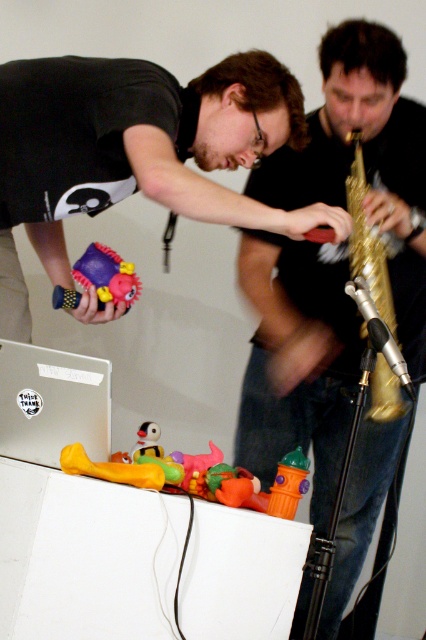
Can you confirm if silver metallic laptop at center is taller than rubberized plastic toy at center?

Yes, silver metallic laptop at center is taller than rubberized plastic toy at center.

Is silver metallic laptop at center positioned before rubberized plastic toy at center?

Yes, silver metallic laptop at center is in front of rubberized plastic toy at center.

Between point (103, 376) and point (106, 284), which one is positioned behind?

Point (106, 284)

Identify the location of silver metallic laptop at center. (52, 403).

Does rubberized plastic toy at center have a lesser width compared to yellow rubber duck at lower left?

Correct, rubberized plastic toy at center's width is less than yellow rubber duck at lower left's.

Who is taller, rubberized plastic toy at center or yellow rubber duck at lower left?

rubberized plastic toy at center

The width and height of the screenshot is (426, 640). I want to click on rubberized plastic toy at center, so click(x=106, y=275).

Where is `rubberized plastic toy at center`? rubberized plastic toy at center is located at coordinates (106, 275).

Is matte black shirt at center to the left of rubber fire hydrant at center from the viewer's perspective?

In fact, matte black shirt at center is to the right of rubber fire hydrant at center.

The width and height of the screenshot is (426, 640). What do you see at coordinates (298, 360) in the screenshot? I see `matte black shirt at center` at bounding box center [298, 360].

Locate an element on the screen. matte black shirt at center is located at coordinates 298,360.

Locate an element on the screen. matte black shirt at center is located at coordinates (298, 360).